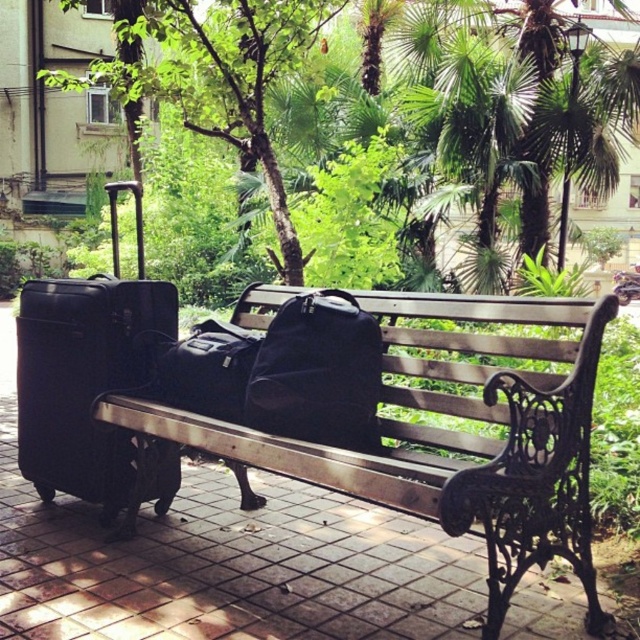
Question: Considering the relative positions of matte black duffel bag at center and matte black backpack at center in the image provided, where is matte black duffel bag at center located with respect to matte black backpack at center?

Choices:
 (A) above
 (B) below

Answer: (B)

Question: Which point is farther from the camera taking this photo?

Choices:
 (A) (134, 349)
 (B) (500, 540)

Answer: (A)

Question: Which is farther from the black matte suitcase at left?

Choices:
 (A) wooden bench at center
 (B) matte black duffel bag at center
 (C) matte black backpack at center

Answer: (A)

Question: Can you confirm if wooden bench at center is wider than matte black duffel bag at center?

Choices:
 (A) yes
 (B) no

Answer: (A)

Question: Which of these objects is positioned farthest from the green leafy tree at upper center?

Choices:
 (A) wooden bench at center
 (B) matte black duffel bag at center

Answer: (B)

Question: Is wooden bench at center above green leafy tree at upper center?

Choices:
 (A) no
 (B) yes

Answer: (A)